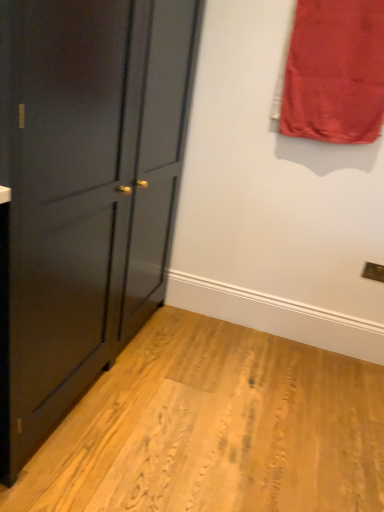
The image size is (384, 512). What do you see at coordinates (335, 72) in the screenshot? I see `red satin curtain at upper right` at bounding box center [335, 72].

At what (x,y) coordinates should I click in order to perform the action: click on red satin curtain at upper right. Please return your answer as a coordinate pair (x, y). Looking at the image, I should click on (335, 72).

Find the location of a particular element. This screenshot has width=384, height=512. matte black cabinet at left is located at coordinates (88, 192).

Describe the element at coordinates (88, 192) in the screenshot. I see `matte black cabinet at left` at that location.

I want to click on red satin curtain at upper right, so click(335, 72).

Considering the positions of objects red satin curtain at upper right and matte black cabinet at left in the image provided, who is more to the left, red satin curtain at upper right or matte black cabinet at left?

matte black cabinet at left.

Is red satin curtain at upper right positioned in front of matte black cabinet at left?

That is False.

Considering the positions of point (285, 91) and point (130, 296), is point (285, 91) closer or farther from the camera than point (130, 296)?

Point (285, 91).

From the image's perspective, is red satin curtain at upper right under matte black cabinet at left?

No, from the image's perspective, red satin curtain at upper right is not beneath matte black cabinet at left.

From a real-world perspective, which object rests below the other?

matte black cabinet at left, from a real-world perspective.

Considering the relative sizes of red satin curtain at upper right and matte black cabinet at left in the image provided, is red satin curtain at upper right wider than matte black cabinet at left?

No, red satin curtain at upper right is not wider than matte black cabinet at left.

Considering the sizes of objects red satin curtain at upper right and matte black cabinet at left in the image provided, who is taller, red satin curtain at upper right or matte black cabinet at left?

Standing taller between the two is matte black cabinet at left.

Between red satin curtain at upper right and matte black cabinet at left, which one has smaller size?

With smaller size is red satin curtain at upper right.

Is red satin curtain at upper right inside the boundaries of matte black cabinet at left, or outside?

red satin curtain at upper right exists outside the volume of matte black cabinet at left.

Is red satin curtain at upper right not near matte black cabinet at left?

No, red satin curtain at upper right is in close proximity to matte black cabinet at left.

Is red satin curtain at upper right aimed at matte black cabinet at left?

No.

This screenshot has width=384, height=512. I want to click on curtain on the right of matte black cabinet at left, so click(335, 72).

Between matte black cabinet at left and red satin curtain at upper right, which one appears on the right side from the viewer's perspective?

red satin curtain at upper right is more to the right.

Considering the positions of objects matte black cabinet at left and red satin curtain at upper right in the image provided, who is in front, matte black cabinet at left or red satin curtain at upper right?

matte black cabinet at left is in front.

Which point is more forward, (1, 339) or (371, 95)?

The point (1, 339) is more forward.

From the image's perspective, is matte black cabinet at left above red satin curtain at upper right?

No.

From a real-world perspective, does matte black cabinet at left sit lower than red satin curtain at upper right?

Yes, from a real-world perspective, matte black cabinet at left is below red satin curtain at upper right.

Considering the relative sizes of matte black cabinet at left and red satin curtain at upper right in the image provided, is matte black cabinet at left thinner than red satin curtain at upper right?

Incorrect, the width of matte black cabinet at left is not less than that of red satin curtain at upper right.

Does matte black cabinet at left have a lesser height compared to red satin curtain at upper right?

Incorrect, the height of matte black cabinet at left does not fall short of that of red satin curtain at upper right.

Is matte black cabinet at left smaller than red satin curtain at upper right?

Incorrect, matte black cabinet at left is not smaller in size than red satin curtain at upper right.

Is matte black cabinet at left inside the boundaries of red satin curtain at upper right, or outside?

matte black cabinet at left is not enclosed by red satin curtain at upper right.

Is matte black cabinet at left in contact with red satin curtain at upper right?

No, matte black cabinet at left is not with red satin curtain at upper right.

Does matte black cabinet at left turn towards red satin curtain at upper right?

Yes, matte black cabinet at left is turned towards red satin curtain at upper right.

Can you tell me how much matte black cabinet at left and red satin curtain at upper right differ in facing direction?

They differ by 87.8 degrees in their facing directions.

The width and height of the screenshot is (384, 512). Identify the location of door lying below the red satin curtain at upper right (from the image's perspective). (88, 192).

You are a GUI agent. You are given a task and a screenshot of the screen. Output one action in this format:
    pyautogui.click(x=<x>, y=<y>)
    Task: Click on the curtain above the matte black cabinet at left (from a real-world perspective)
    This screenshot has height=512, width=384.
    Given the screenshot: What is the action you would take?
    pyautogui.click(x=335, y=72)

Find the location of a particular element. Image resolution: width=384 pixels, height=512 pixels. curtain on the right of the matte black cabinet at left is located at coordinates (335, 72).